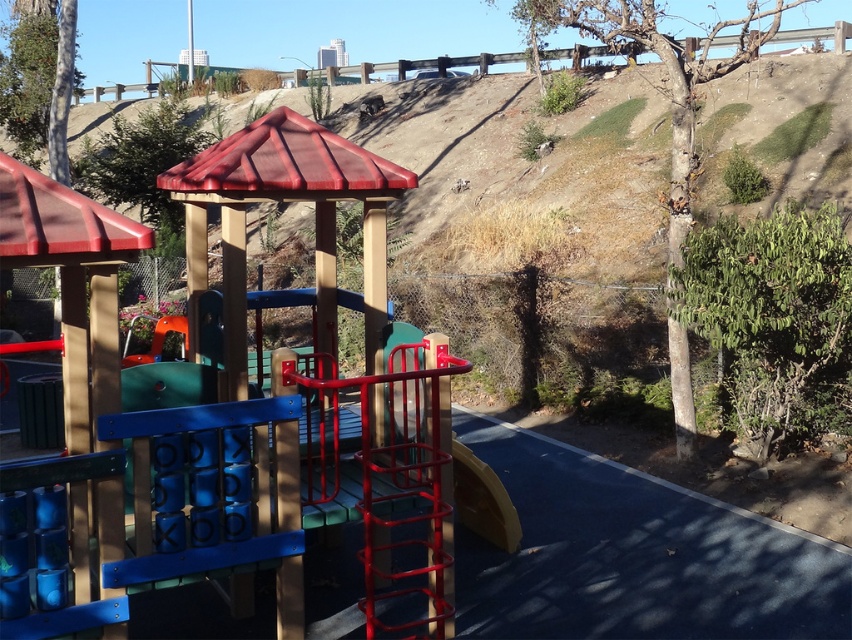
From the picture: You are a parent trying to decide which part of the playground to let your child play on first. You see the wooden playground structure at center and the smooth plastic slide at center. Which of these two has a greater width?

The wooden playground structure at center has a greater width than the smooth plastic slide at center.

You are a parent trying to decide which play area to let your child explore first. The wooden playground structure at center and the smooth plastic slide at center are both available. Which one is taller?

The wooden playground structure at center is much taller than the smooth plastic slide at center, so it is the taller one.